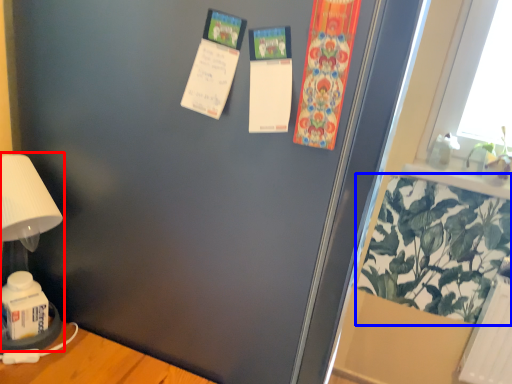
Question: Which object is further to the camera taking this photo, table lamp (highlighted by a red box) or plant (highlighted by a blue box)?

Choices:
 (A) table lamp
 (B) plant

Answer: (B)